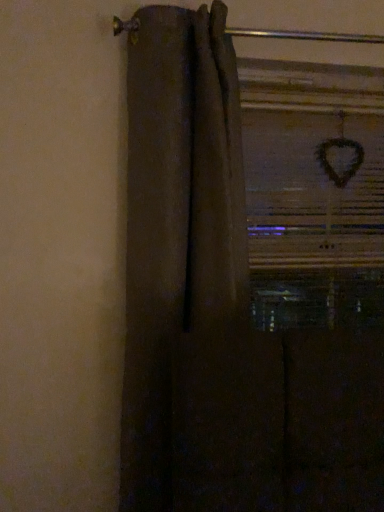
You are a GUI agent. You are given a task and a screenshot of the screen. Output one action in this format:
    pyautogui.click(x=<x>, y=<y>)
    Task: Click on the brown fabric curtain at left
    
    Given the screenshot: What is the action you would take?
    pyautogui.click(x=222, y=312)

What do you see at coordinates (222, 312) in the screenshot? I see `brown fabric curtain at left` at bounding box center [222, 312].

I want to click on brown fabric curtain at left, so click(x=222, y=312).